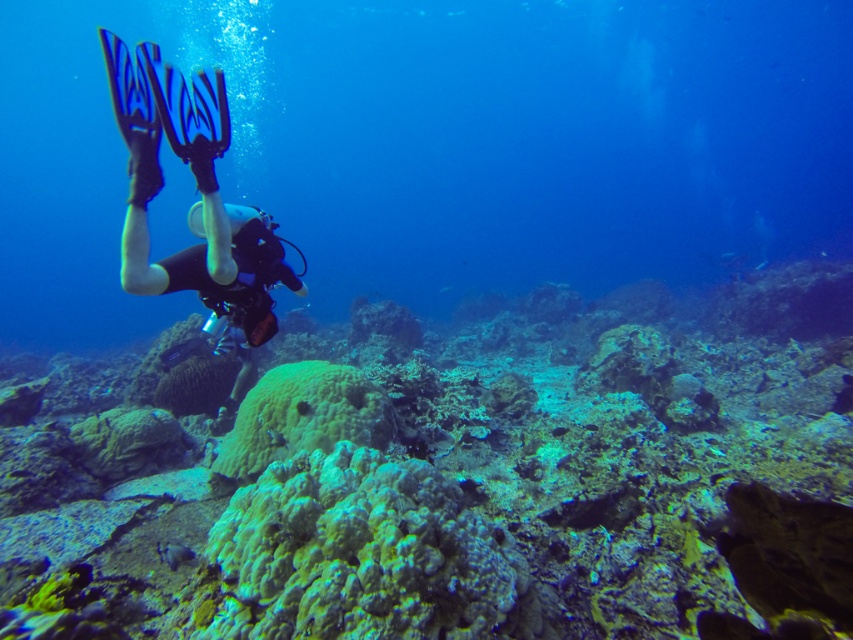
Question: Is green coral reef at center thinner than black matte scuba diver at left?

Choices:
 (A) no
 (B) yes

Answer: (A)

Question: Which point is closer to the camera taking this photo?

Choices:
 (A) (277, 244)
 (B) (337, 529)
 (C) (262, 445)
 (D) (67, 460)

Answer: (B)

Question: Is black matte scuba diver at left below green matte coral at center?

Choices:
 (A) no
 (B) yes

Answer: (A)

Question: Which object is positioned closest to the green porous coral at center?

Choices:
 (A) green coral reef at center
 (B) black matte scuba diver at left

Answer: (A)

Question: Which is nearer to the green matte coral at center?

Choices:
 (A) green porous coral at center
 (B) green coral reef at center
 (C) black matte scuba diver at left

Answer: (C)

Question: Is green coral reef at center thinner than black matte scuba diver at left?

Choices:
 (A) no
 (B) yes

Answer: (A)